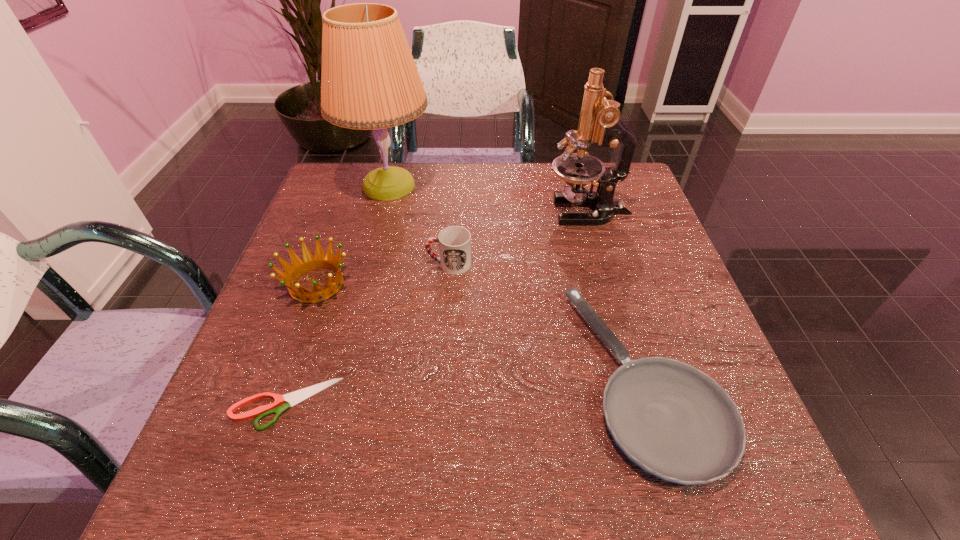
The image size is (960, 540). I want to click on lamp, so click(369, 80).

Where is `microscope`? The image size is (960, 540). microscope is located at coordinates (600, 122).

In order to click on cup in this screenshot , I will do `click(454, 242)`.

Locate an element on the screen. The height and width of the screenshot is (540, 960). crown is located at coordinates (319, 261).

You are a GUI agent. You are given a task and a screenshot of the screen. Output one action in this format:
    pyautogui.click(x=<x>, y=<y>)
    Task: Click on the frying pan
    
    Given the screenshot: What is the action you would take?
    pyautogui.click(x=675, y=422)

This screenshot has width=960, height=540. I want to click on the shortest object, so [296, 397].

At what (x,y) coordinates should I click in order to perform the action: click on vacant space located on the side of the tallest object near the pull switch. Please return your answer as a coordinate pair (x, y). Looking at the image, I should click on (540, 186).

Find the location of a particular element. This screenshot has height=540, width=960. vacant point located 0.050m at the eyepiece of the second tallest object is located at coordinates (527, 211).

The image size is (960, 540). Identify the location of vacant space located at the eyepiece of the second tallest object. (516, 211).

I want to click on free space located at the eyepiece of the second tallest object, so click(x=523, y=211).